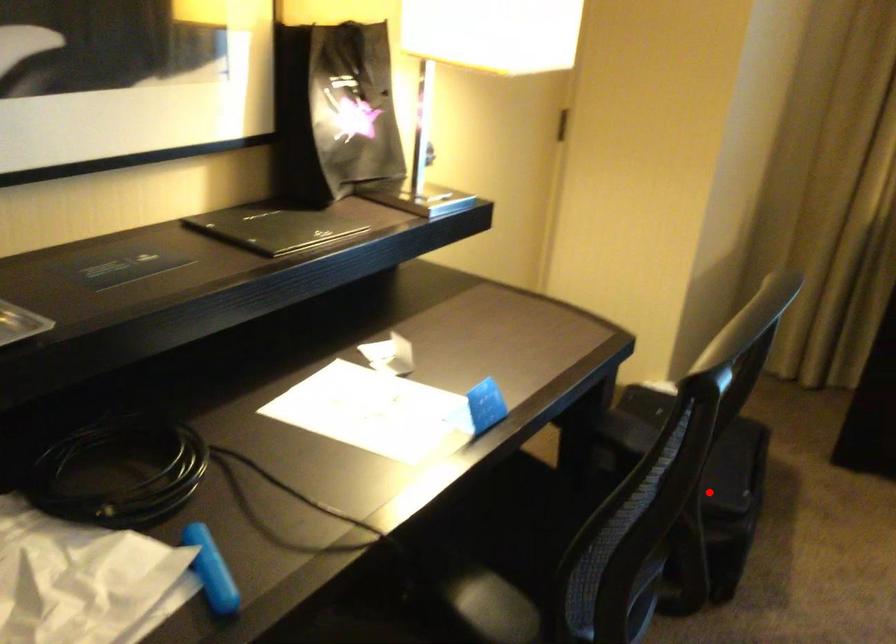
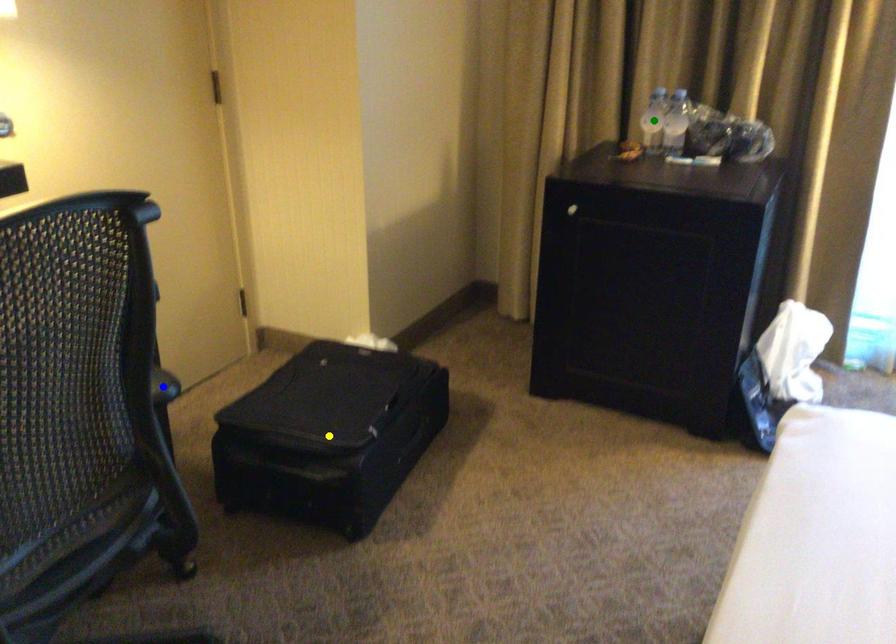
Question: I am providing you with two images of the same scene from different viewpoints. A red point is marked on the first image. You are given multiple points on the second image. Which spot in image 2 lines up with the point in image 1?

Choices:
 (A) blue point
 (B) green point
 (C) yellow point

Answer: (C)